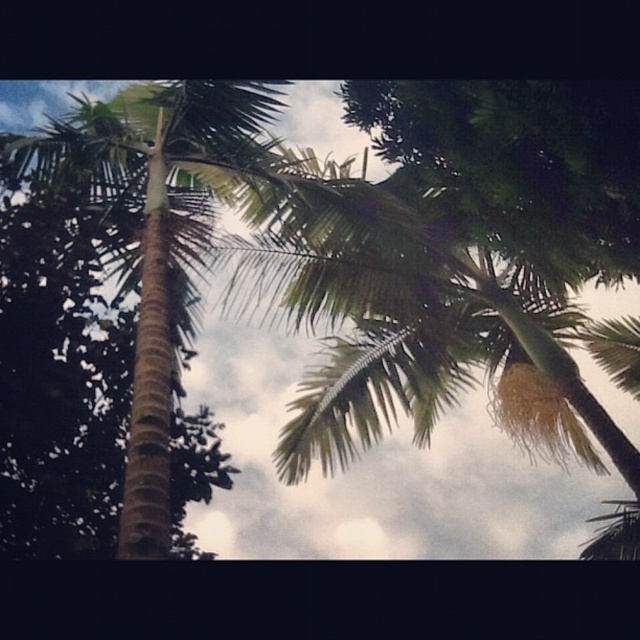
Which is below, green leafy coconut tree at upper center or green leafy palm tree at left?

Positioned lower is green leafy palm tree at left.

Does green leafy coconut tree at upper center have a larger size compared to green leafy palm tree at left?

Indeed, green leafy coconut tree at upper center has a larger size compared to green leafy palm tree at left.

Is point (358, 396) positioned behind point (120, 524)?

Yes, it is.

This screenshot has width=640, height=640. Identify the location of green leafy coconut tree at upper center. (467, 266).